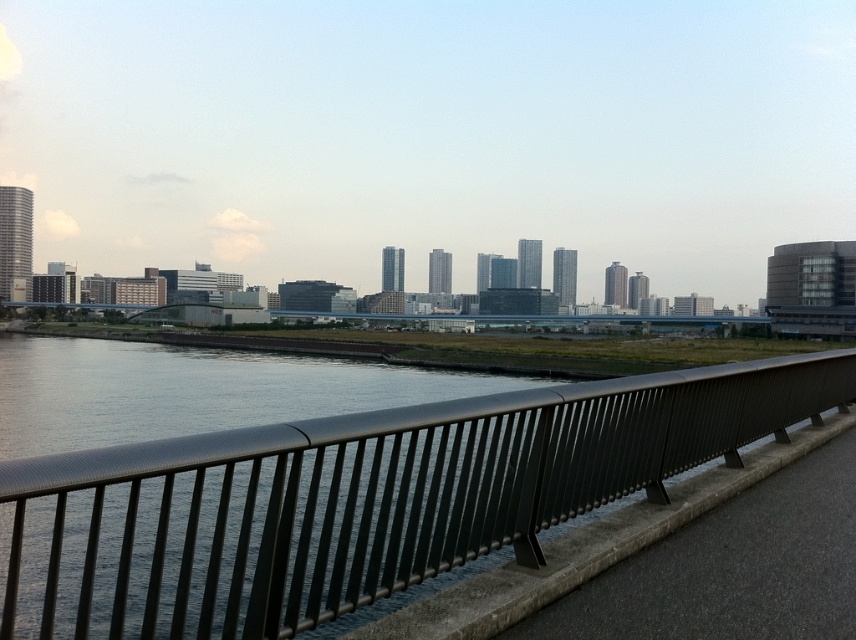
You are standing on the walkway and see both the metallic gray railing at center and the black metal railing at center. Which one is located to the left?

The metallic gray railing at center is positioned on the left side of the black metal railing at center.

You are standing on the grassy embankment and see the point at coordinates point [360,499]. Is this point located on the metallic gray railing at center?

Yes, the point [360,499] is located on the metallic gray railing at center according to the description.

You are standing on a bridge and see the metallic gray railing at center and the black metal railing at center. Which one is above the other?

The metallic gray railing at center is positioned over the black metal railing at center.